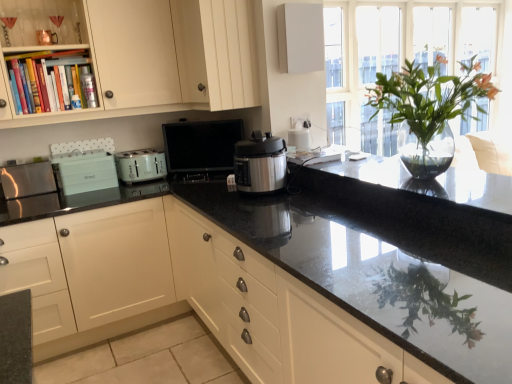
Locate an element on the screen. free point above matte black microwave at center, which is the first appliance from right to left (from a real-world perspective) is located at coordinates (201, 124).